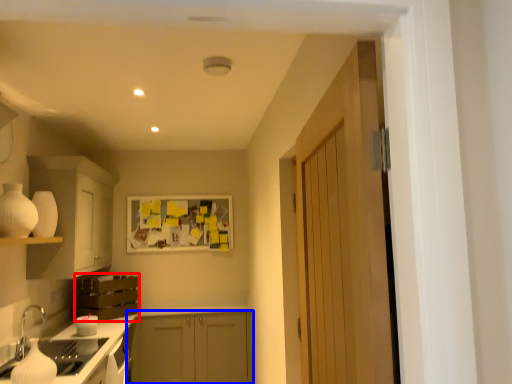
Question: Which object is further to the camera taking this photo, cabinetry (highlighted by a red box) or cabinetry (highlighted by a blue box)?

Choices:
 (A) cabinetry
 (B) cabinetry

Answer: (B)